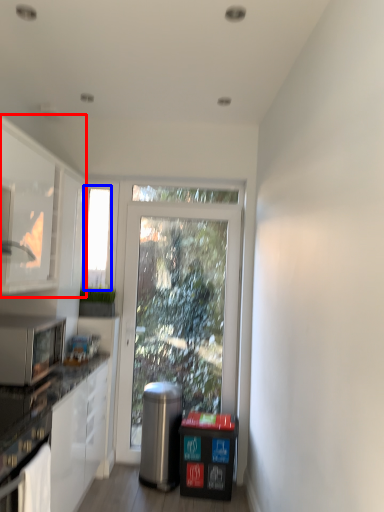
Question: Among these objects, which one is farthest to the camera, cabinetry (highlighted by a red box) or window screen (highlighted by a blue box)?

Choices:
 (A) cabinetry
 (B) window screen

Answer: (B)